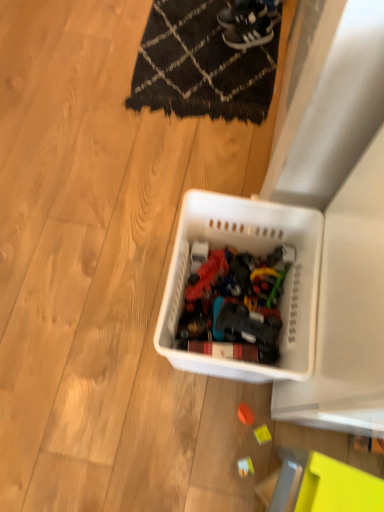
Question: In the image, is white plastic basket at center on the left side or the right side of white leather sneakers at upper center, which is the second footwear from top to bottom?

Choices:
 (A) left
 (B) right

Answer: (A)

Question: In terms of size, does white plastic basket at center appear bigger or smaller than white leather sneakers at upper center, the first footwear from the bottom?

Choices:
 (A) small
 (B) big

Answer: (B)

Question: Which object is the closest to the white plastic toy at lower center, the third toy in the top-to-bottom sequence?

Choices:
 (A) orange matte ball at center, acting as the 3th toy starting from the bottom
 (B) white plastic basket at center
 (C) white leather sneakers at upper center, which is the second footwear from top to bottom
 (D) black woven mat at upper center
 (E) yellow plastic toy at lower right, arranged as the 2th toy when ordered from the bottom

Answer: (E)

Question: Which object is the closest to the yellow plastic toy at lower right, arranged as the 2th toy when ordered from the bottom?

Choices:
 (A) white plastic basket at center
 (B) white plastic toy at lower center, the third toy in the top-to-bottom sequence
 (C) black woven mat at upper center
 (D) orange matte ball at center, which ranks as the 1th toy in top-to-bottom order
 (E) white leather sneakers at upper center, which is the second footwear from top to bottom

Answer: (D)